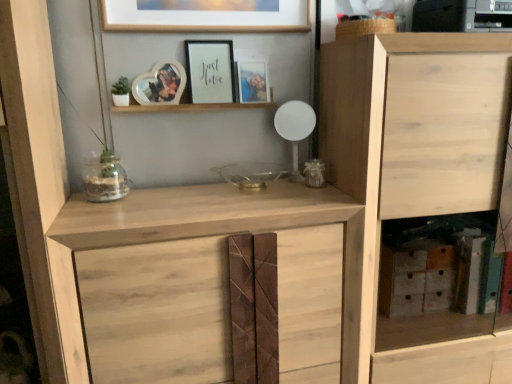
You are a GUI agent. You are given a task and a screenshot of the screen. Output one action in this format:
    pyautogui.click(x=<x>, y=<y>)
    Task: Click on the vacant region to the right of clear glass vase at center
    The height and width of the screenshot is (384, 512).
    Given the screenshot: What is the action you would take?
    pyautogui.click(x=157, y=193)